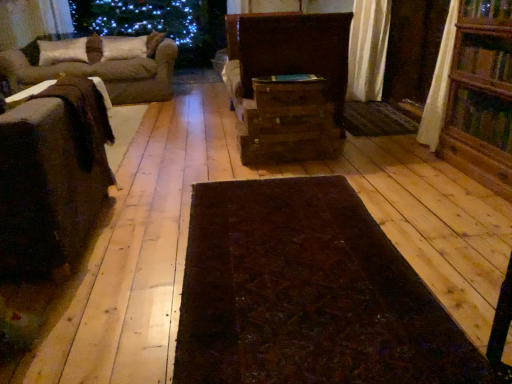
At what (x,y) coordinates should I click in order to perform the action: click on free space in front of brown wooden drawer at center, which is counted as the 3th drawer, starting from the top. Please return your answer as a coordinate pair (x, y). Looking at the image, I should click on (271, 176).